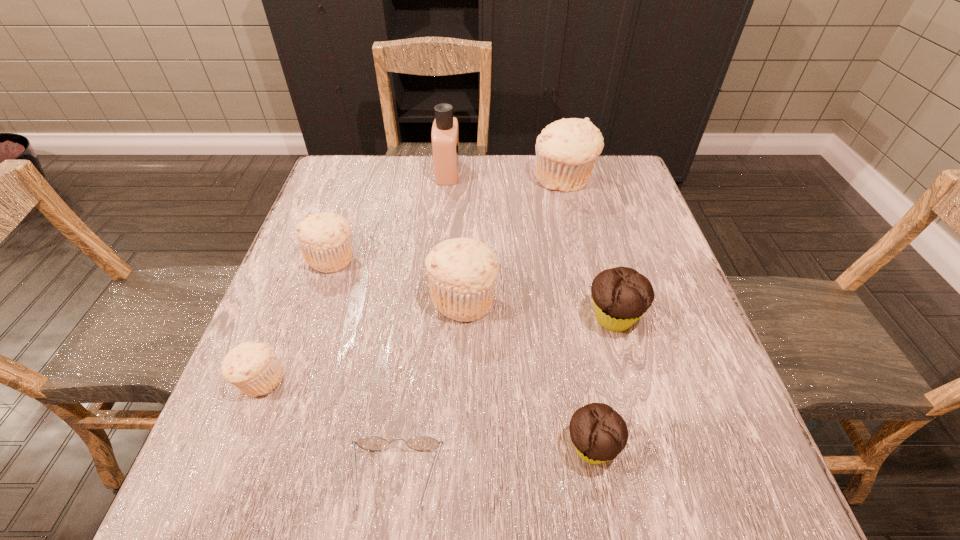
Image resolution: width=960 pixels, height=540 pixels. Identify the location of the smaller chocolate muffin. (599, 433).

Find the location of `the shortest object`. the shortest object is located at coordinates (371, 443).

This screenshot has height=540, width=960. I want to click on spectacles, so click(371, 443).

I want to click on vacant space situated 0.400m on the front label of the perfume, so click(x=598, y=172).

Find the location of a particular element. vacant area situated 0.360m on the left of the tallest muffin is located at coordinates (405, 180).

Locate an element on the screen. Image resolution: width=960 pixels, height=540 pixels. vacant space located 0.200m on the front of the second beige muffin from right to left is located at coordinates (460, 421).

I want to click on vacant space located 0.130m on the front of the third biggest beige muffin, so click(310, 322).

Identify the location of vacant space located 0.120m on the back of the bigger chocolate muffin. (597, 256).

Image resolution: width=960 pixels, height=540 pixels. What are the coordinates of `blank space located 0.180m on the back of the second nearest muffin` in the screenshot? It's located at (296, 289).

At what (x,y) coordinates should I click in order to perform the action: click on vacant region located 0.110m on the left of the nearest muffin. Please return your answer as a coordinate pair (x, y). This screenshot has width=960, height=540. Looking at the image, I should click on (496, 447).